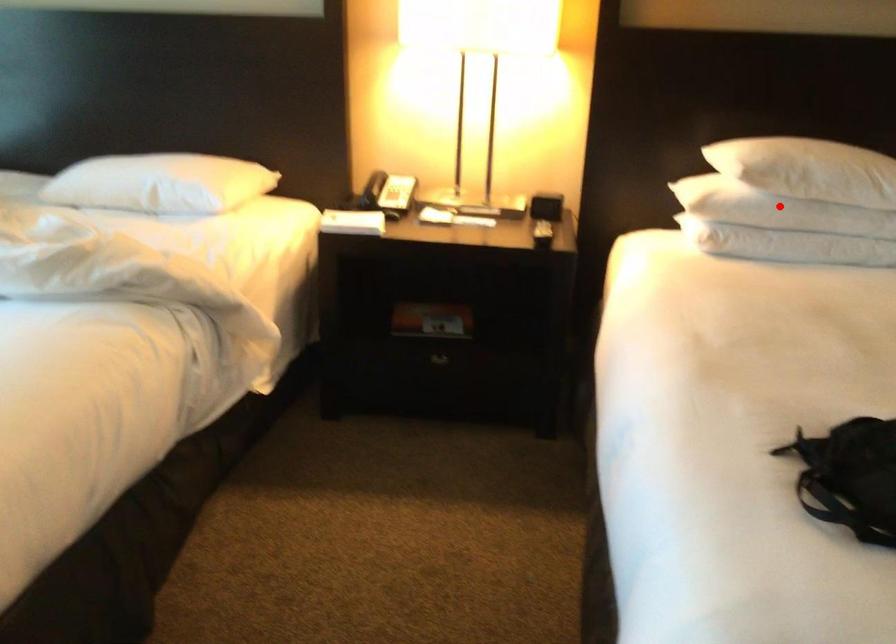
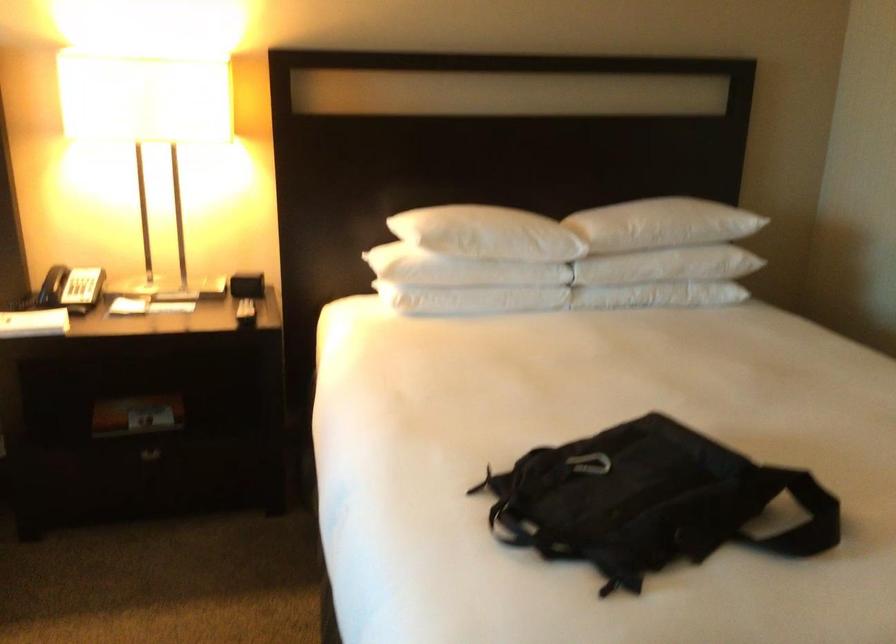
Question: I am providing you with two images of the same scene from different viewpoints. A red point is marked on the first image. Can you still see the location of the red point in image 2?

Choices:
 (A) Yes
 (B) No

Answer: (A)